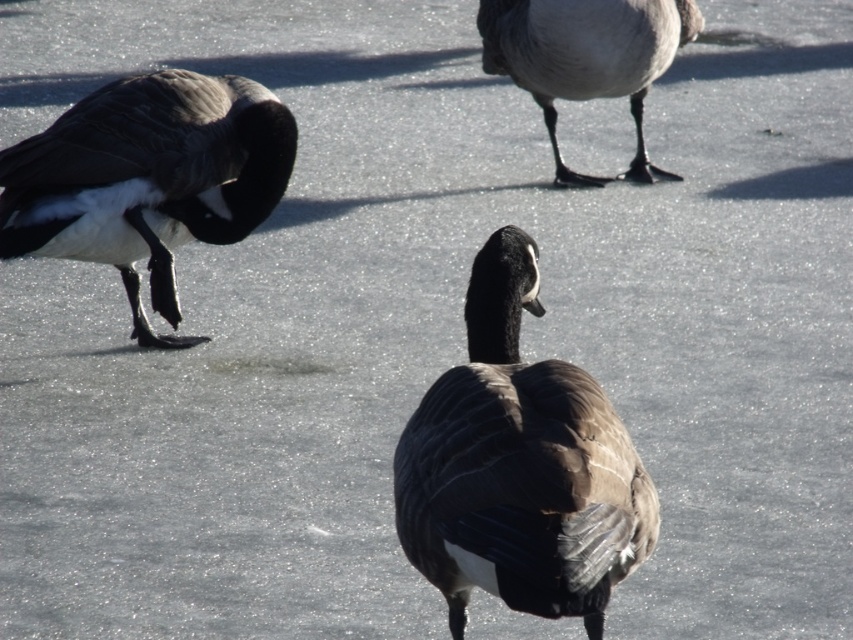
Question: Does brown textured goose at center appear on the left side of gray matte duck feet at upper center?

Choices:
 (A) no
 (B) yes

Answer: (B)

Question: Which object is positioned farthest from the dark brown feathers at left?

Choices:
 (A) gray matte duck feet at upper center
 (B) brown textured goose at center

Answer: (A)

Question: Is brown textured goose at center closer to camera compared to gray matte duck feet at upper center?

Choices:
 (A) yes
 (B) no

Answer: (A)

Question: Does brown textured goose at center have a greater width compared to dark brown feathers at left?

Choices:
 (A) no
 (B) yes

Answer: (A)

Question: Which point is farther to the camera?

Choices:
 (A) dark brown feathers at left
 (B) brown textured goose at center
 (C) gray matte duck feet at upper center

Answer: (C)

Question: Which object is positioned farthest from the dark brown feathers at left?

Choices:
 (A) gray matte duck feet at upper center
 (B) brown textured goose at center

Answer: (A)